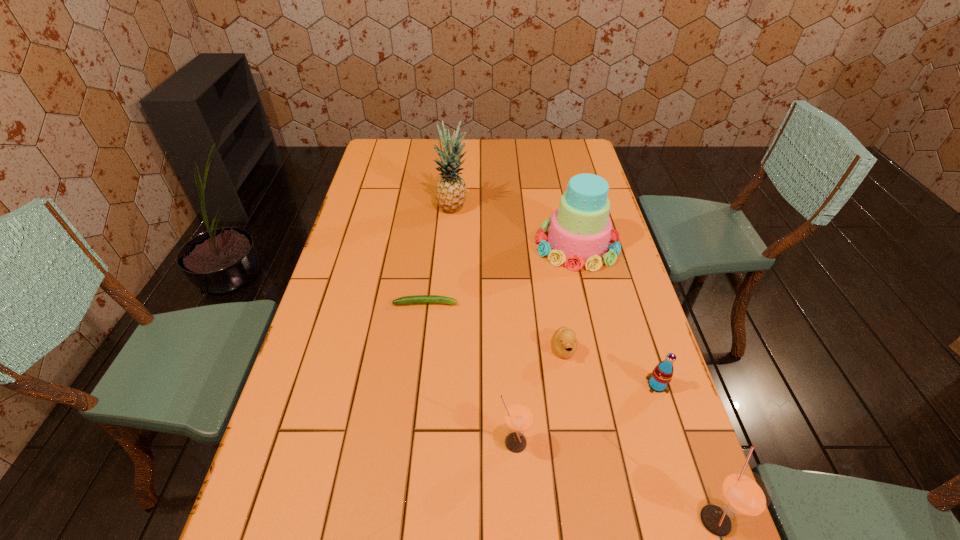
The image size is (960, 540). What are the coordinates of `the third shortest object` in the screenshot? It's located at (658, 381).

You are a GUI agent. You are given a task and a screenshot of the screen. Output one action in this format:
    pyautogui.click(x=<x>, y=<y>)
    Task: Click on the free spot located 0.220m on the left of the shorter straw
    
    Given the screenshot: What is the action you would take?
    tap(399, 442)

What are the coordinates of `free region located 0.190m on the front of the cake` in the screenshot? It's located at (595, 320).

Identify the location of vacant space located on the right of the farthest object. The width and height of the screenshot is (960, 540). (516, 209).

The width and height of the screenshot is (960, 540). Identify the location of blank area located 0.300m on the face of the second shortest object. point(587,485).

You are a GUI agent. You are given a task and a screenshot of the screen. Output one action in this format:
    pyautogui.click(x=<x>, y=<y>)
    Task: Click on the vacant space located 0.140m on the front-facing side of the shortest object
    The width and height of the screenshot is (960, 540).
    Given the screenshot: What is the action you would take?
    pyautogui.click(x=506, y=303)

I want to click on free point located on the left of the fifth farthest object, so click(x=607, y=385).

The width and height of the screenshot is (960, 540). I want to click on cake present at the right edge, so click(579, 231).

Where is `soda that is positioned at the right edge`? The width and height of the screenshot is (960, 540). soda that is positioned at the right edge is located at coordinates (658, 381).

I want to click on vacant space at the far edge of the desktop, so coord(519,164).